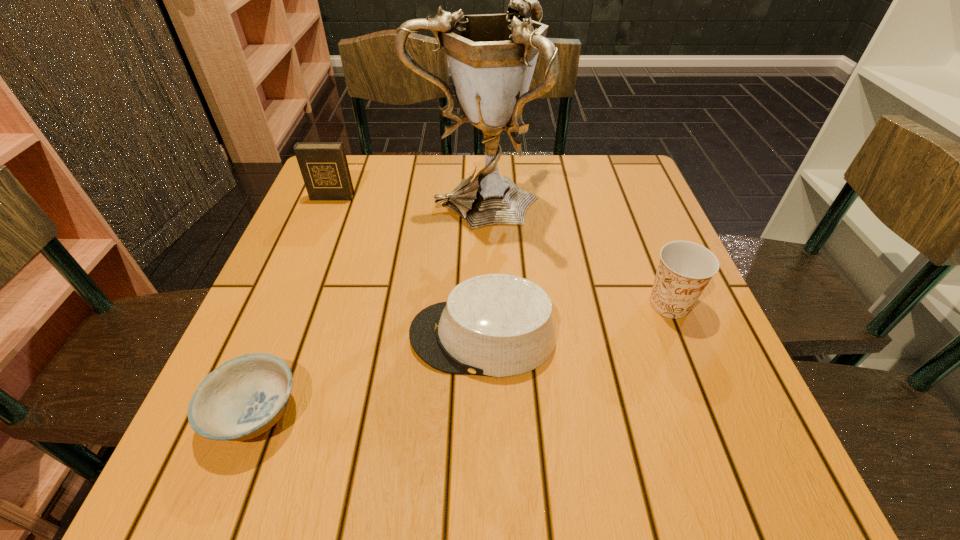
Find the location of a particular element. the tallest object is located at coordinates (492, 57).

Locate an element on the screen. Image resolution: width=960 pixels, height=540 pixels. diary is located at coordinates (323, 165).

Where is `Dixie cup`? The height and width of the screenshot is (540, 960). Dixie cup is located at coordinates (685, 268).

Where is `the third shortest object`? This screenshot has height=540, width=960. the third shortest object is located at coordinates (685, 268).

At what (x,y) coordinates should I click in order to perform the action: click on hat. Please return your answer as a coordinate pair (x, y). This screenshot has width=960, height=540. Looking at the image, I should click on (497, 325).

What are the coordinates of `bowl` in the screenshot? It's located at (244, 397).

The width and height of the screenshot is (960, 540). I want to click on vacant area situated 0.080m on the right of the trophy cup, so click(571, 201).

At what (x,y) coordinates should I click in order to perform the action: click on free space located 0.060m on the front cover of the fourth shortest object. Please return your answer as a coordinate pair (x, y). Image resolution: width=960 pixels, height=540 pixels. Looking at the image, I should click on (324, 215).

You are a GUI agent. You are given a task and a screenshot of the screen. Output one action in this format:
    pyautogui.click(x=<x>, y=<y>)
    Task: Click on the blank space located 0.140m on the left of the third shortest object
    The height and width of the screenshot is (540, 960).
    Given the screenshot: What is the action you would take?
    pyautogui.click(x=571, y=303)

You are a GUI agent. You are given a task and a screenshot of the screen. Output one action in this format:
    pyautogui.click(x=<x>, y=<y>)
    Task: Click on the vacant space located on the front-facing side of the second shortest object
    Image resolution: width=960 pixels, height=540 pixels.
    Given the screenshot: What is the action you would take?
    [x=288, y=336]